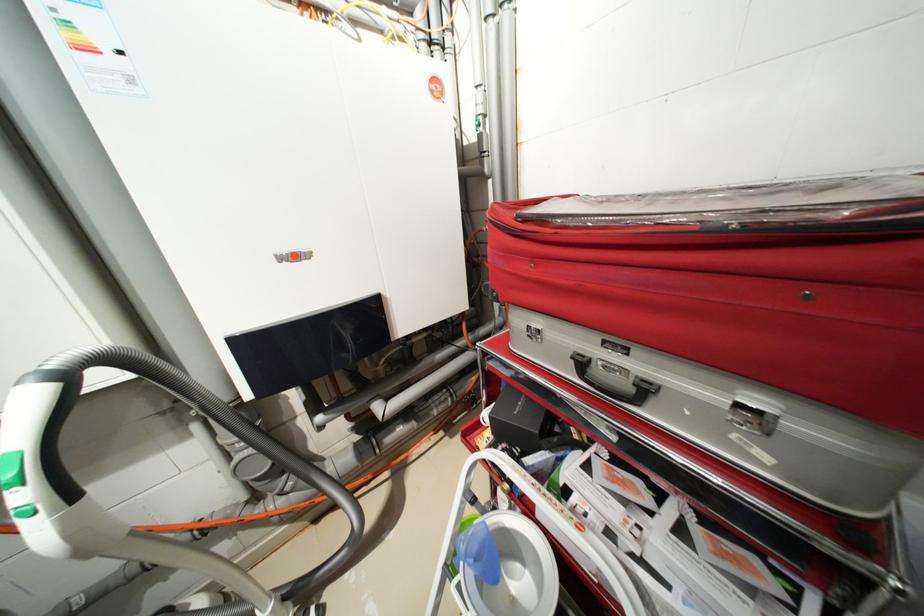
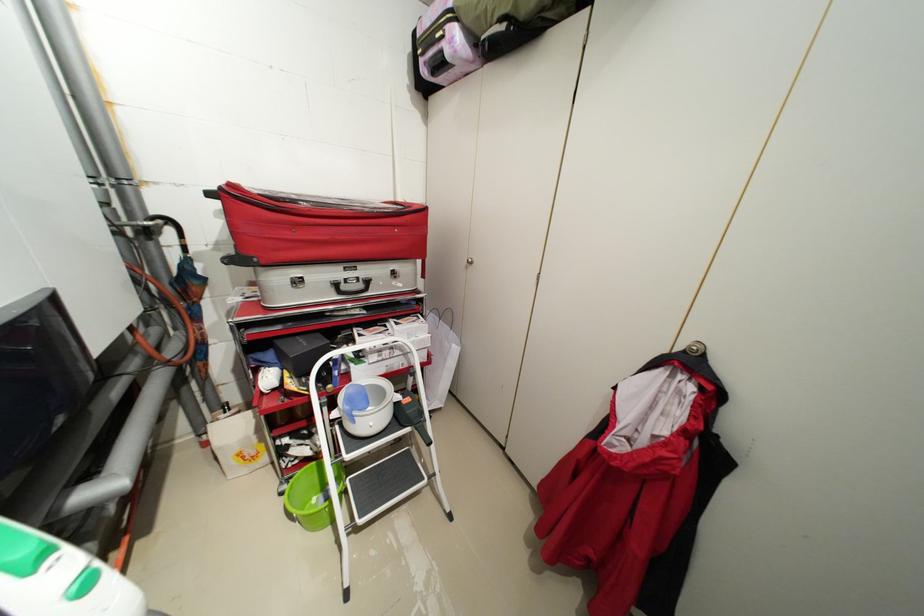
Question: The camera is either moving clockwise (left) or counter-clockwise (right) around the object. The first image is from the beginning of the video and the second image is from the end. Is the camera moving left or right when shooting the video?

Choices:
 (A) Left
 (B) Right

Answer: (A)